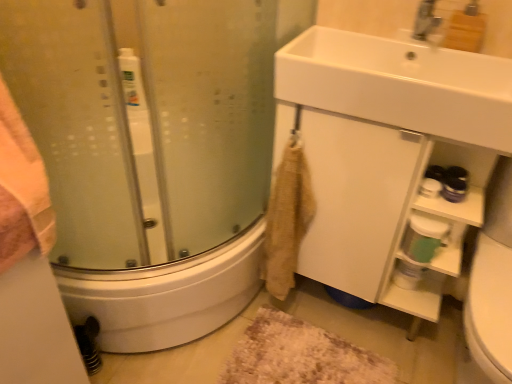
What do you see at coordinates (301, 355) in the screenshot? Image resolution: width=512 pixels, height=384 pixels. I see `brown shaggy bath mat at lower center` at bounding box center [301, 355].

In order to face white matte cabinet at lower right, should I rotate leftwards or rightwards?

A 14.728 degree turn to the right will do.

Identify the location of green plastic container at lower right. (432, 243).

Locate an element on the screen. This screenshot has width=512, height=384. beige textured towel at lower center is located at coordinates (287, 219).

This screenshot has width=512, height=384. Find the location of `bathroom cabinet on the left of green plastic container at lower right`. bathroom cabinet on the left of green plastic container at lower right is located at coordinates (383, 208).

What's the angular difference between white matte cabinet at lower right and green plastic container at lower right's facing directions?

They differ by 0.000688 degrees in their facing directions.

Can you confirm if white matte cabinet at lower right is smaller than green plastic container at lower right?

Actually, white matte cabinet at lower right might be larger than green plastic container at lower right.

From a real-world perspective, which object stands above the other?

green plastic container at lower right, from a real-world perspective.

Is brown shaggy bath mat at lower center oriented towards transparent glass shower door at left?

No.

Considering the positions of objects brown shaggy bath mat at lower center and transparent glass shower door at left in the image provided, who is behind, brown shaggy bath mat at lower center or transparent glass shower door at left?

brown shaggy bath mat at lower center is more distant.

Considering the sizes of brown shaggy bath mat at lower center and transparent glass shower door at left in the image, is brown shaggy bath mat at lower center wider or thinner than transparent glass shower door at left?

Considering their sizes, brown shaggy bath mat at lower center looks slimmer than transparent glass shower door at left.

Is brown shaggy bath mat at lower center not inside transparent glass shower door at left?

Yes, brown shaggy bath mat at lower center is not within transparent glass shower door at left.

Does white matte cabinet at lower right have a greater width compared to beige textured towel at lower center?

Correct, the width of white matte cabinet at lower right exceeds that of beige textured towel at lower center.

Are white matte cabinet at lower right and beige textured towel at lower center beside each other?

There is a gap between white matte cabinet at lower right and beige textured towel at lower center.

Considering the relative sizes of white matte cabinet at lower right and beige textured towel at lower center in the image provided, is white matte cabinet at lower right smaller than beige textured towel at lower center?

Actually, white matte cabinet at lower right might be larger than beige textured towel at lower center.

Considering the relative sizes of beige textured towel at lower center and brown shaggy bath mat at lower center in the image provided, is beige textured towel at lower center thinner than brown shaggy bath mat at lower center?

Yes.

Considering their positions, is beige textured towel at lower center located in front of or behind brown shaggy bath mat at lower center?

In the image, beige textured towel at lower center appears in front of brown shaggy bath mat at lower center.

Can brown shaggy bath mat at lower center be found inside beige textured towel at lower center?

No, brown shaggy bath mat at lower center is not inside beige textured towel at lower center.

Is transparent glass shower door at left far from white glossy sink at upper right?

No, transparent glass shower door at left is in close proximity to white glossy sink at upper right.

Considering the points (51, 15) and (407, 94), which point is behind, point (51, 15) or point (407, 94)?

The point (407, 94) is farther from the camera.

In the scene shown: Can you confirm if transparent glass shower door at left is smaller than white glossy sink at upper right?

No.

Where is `shower door on the left of the white glossy sink at upper right`? The width and height of the screenshot is (512, 384). shower door on the left of the white glossy sink at upper right is located at coordinates (152, 152).

From a real-world perspective, relative to white matte cabinet at lower right, is brown shaggy bath mat at lower center vertically above or below?

Clearly, from a real-world perspective, brown shaggy bath mat at lower center is below white matte cabinet at lower right.

Considering the sizes of objects brown shaggy bath mat at lower center and white matte cabinet at lower right in the image provided, who is taller, brown shaggy bath mat at lower center or white matte cabinet at lower right?

With more height is white matte cabinet at lower right.

Which object is positioned more to the left, brown shaggy bath mat at lower center or white matte cabinet at lower right?

brown shaggy bath mat at lower center.

Can you tell me how much brown shaggy bath mat at lower center and white matte cabinet at lower right differ in facing direction?

1.49 degrees separate the facing orientations of brown shaggy bath mat at lower center and white matte cabinet at lower right.

From the image's perspective, which object appears higher, green plastic container at lower right or brown shaggy bath mat at lower center?

green plastic container at lower right, from the image's perspective.

From a real-world perspective, relative to brown shaggy bath mat at lower center, is green plastic container at lower right vertically above or below?

Clearly, from a real-world perspective, green plastic container at lower right is above brown shaggy bath mat at lower center.

Based on the photo, can you confirm if green plastic container at lower right is shorter than brown shaggy bath mat at lower center?

No, green plastic container at lower right is not shorter than brown shaggy bath mat at lower center.

Identify the location of bathroom cabinet directly beneath the green plastic container at lower right (from a real-world perspective). The image size is (512, 384). (383, 208).

You are a GUI agent. You are given a task and a screenshot of the screen. Output one action in this format:
    pyautogui.click(x=<x>, y=<y>)
    Task: Click on the shower door on the left of brown shaggy bath mat at lower center
    The width and height of the screenshot is (512, 384).
    Given the screenshot: What is the action you would take?
    pyautogui.click(x=152, y=152)

From the image, which object appears to be farther from green plastic container at lower right, brown shaggy bath mat at lower center or white matte cabinet at lower right?

Based on the image, brown shaggy bath mat at lower center appears to be further to green plastic container at lower right.

From the image, which object appears to be farther from brown shaggy bath mat at lower center, white glossy sink at upper right or green plastic container at lower right?

white glossy sink at upper right is positioned further to the anchor brown shaggy bath mat at lower center.

Based on their spatial positions, is beige textured towel at lower center or transparent glass shower door at left further from green plastic container at lower right?

The object further to green plastic container at lower right is transparent glass shower door at left.

Looking at the image, which one is located further to white matte cabinet at lower right, white glossy sink at upper right or brown shaggy bath mat at lower center?

brown shaggy bath mat at lower center is positioned further to the anchor white matte cabinet at lower right.

Considering their positions, is green plastic container at lower right positioned closer to white glossy sink at upper right than beige textured towel at lower center?

The object closer to white glossy sink at upper right is beige textured towel at lower center.

Looking at the image, which one is located further to white glossy sink at upper right, beige textured towel at lower center or green plastic container at lower right?

Based on the image, green plastic container at lower right appears to be further to white glossy sink at upper right.

From the image, which object appears to be nearer to green plastic container at lower right, beige textured towel at lower center or brown shaggy bath mat at lower center?

The object closer to green plastic container at lower right is beige textured towel at lower center.

Considering their positions, is green plastic container at lower right positioned closer to beige textured towel at lower center than brown shaggy bath mat at lower center?

brown shaggy bath mat at lower center is positioned closer to the anchor beige textured towel at lower center.

Where is `bath towel between transparent glass shower door at left and white matte cabinet at lower right in the horizontal direction`? bath towel between transparent glass shower door at left and white matte cabinet at lower right in the horizontal direction is located at coordinates pyautogui.click(x=287, y=219).

The width and height of the screenshot is (512, 384). I want to click on bath towel between transparent glass shower door at left and green plastic container at lower right, so click(287, 219).

You are a GUI agent. You are given a task and a screenshot of the screen. Output one action in this format:
    pyautogui.click(x=<x>, y=<y>)
    Task: Click on the sink between transparent glass shower door at left and white matte cabinet at lower right from left to right
    The height and width of the screenshot is (384, 512).
    Given the screenshot: What is the action you would take?
    pyautogui.click(x=397, y=77)

Locate an element on the screen. The height and width of the screenshot is (384, 512). shelf between beige textured towel at lower center and brown shaggy bath mat at lower center in the up-down direction is located at coordinates coord(432,243).